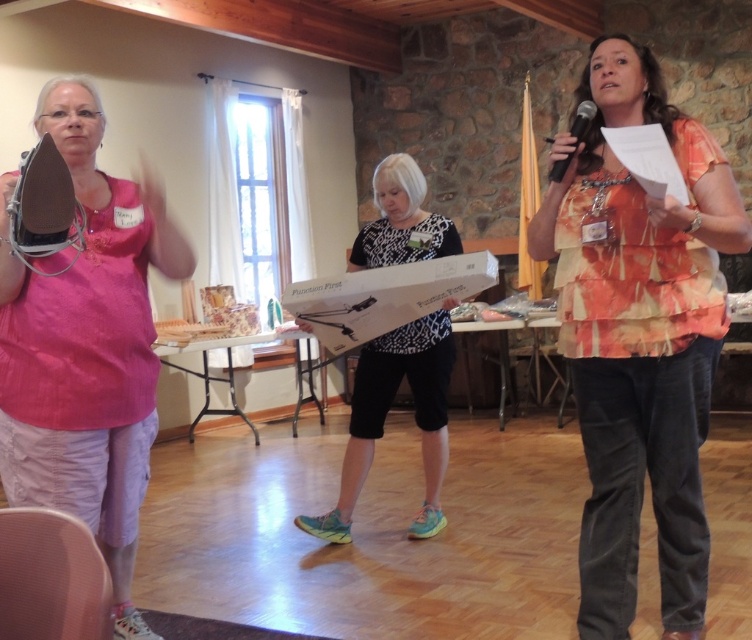
Question: Which object is farther from the camera taking this photo?

Choices:
 (A) white dotted shirt at center
 (B) orange tie-dye shirt at center
 (C) black plastic microphone at upper right

Answer: (A)

Question: Is white dotted shirt at center positioned at the back of black plastic microphone at upper right?

Choices:
 (A) no
 (B) yes

Answer: (B)

Question: Which point is closer to the camera?

Choices:
 (A) (344, 486)
 (B) (584, 120)
 (C) (129, 394)

Answer: (C)

Question: Is orange tie-dye shirt at center to the left of black plastic microphone at upper right from the viewer's perspective?

Choices:
 (A) yes
 (B) no

Answer: (B)

Question: Which of these objects is positioned farthest from the orange tie-dye shirt at center?

Choices:
 (A) matte pink shirt at left
 (B) white dotted shirt at center
 (C) black plastic microphone at upper right

Answer: (A)

Question: Does orange tie-dye shirt at center have a larger size compared to matte pink shirt at left?

Choices:
 (A) no
 (B) yes

Answer: (A)